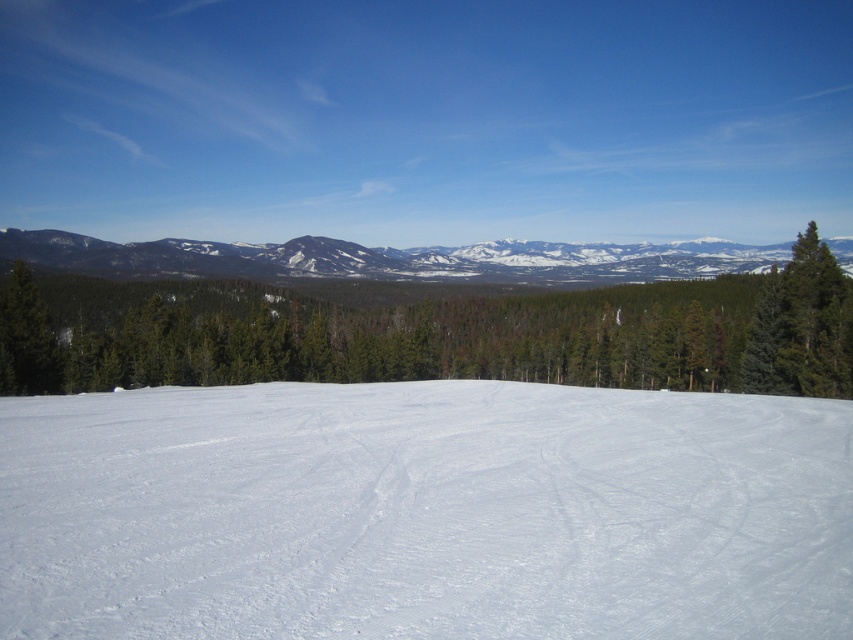
You are an observer standing at the edge of the snow and forest. Which object is closer to you, the white smooth snow at center or the green matte tree at center?

The white smooth snow at center is closer to you because it is positioned below the green matte tree at center, indicating it is in the foreground.

You are an outdoor enthusiast planning to hike to the base of the snowy rocky mountain at upper center. You notice the green matte tree at center along the way. Which object will you encounter first as you start your hike from the snow covered ground in the foreground?

You will encounter the green matte tree at center first because it is much taller than the snowy rocky mountain at upper center, meaning it is closer to the foreground.